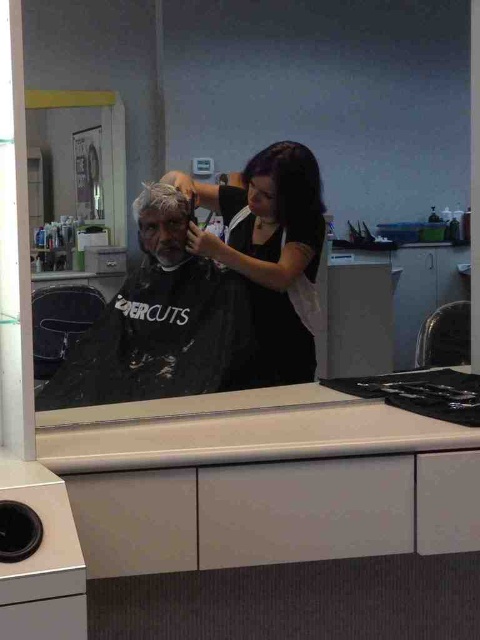
Consider the image. Does dark purple hair at center have a lesser height compared to white matte hair at upper center?

Result: Incorrect, dark purple hair at center's height does not fall short of white matte hair at upper center's.

Does dark purple hair at center appear under white matte hair at upper center?

Correct, dark purple hair at center is located below white matte hair at upper center.

Between point (205, 196) and point (165, 209), which one is positioned behind?

Point (205, 196)

What are the coordinates of `dark purple hair at center` in the screenshot? It's located at (269, 250).

Does black matte cape at center have a greater height compared to dark purple hair at center?

No.

Does black matte cape at center appear over dark purple hair at center?

No.

Is point (41, 388) farther from camera compared to point (277, 372)?

No, it is in front of (277, 372).

At what (x,y) coordinates should I click in order to perform the action: click on black matte cape at center. Please return your answer as a coordinate pair (x, y). Looking at the image, I should click on (158, 323).

Can you confirm if black matte cape at center is smaller than white matte hair at upper center?

No, black matte cape at center is not smaller than white matte hair at upper center.

Does black matte cape at center appear on the left side of white matte hair at upper center?

No, black matte cape at center is not to the left of white matte hair at upper center.

What are the coordinates of `black matte cape at center` in the screenshot? It's located at tap(158, 323).